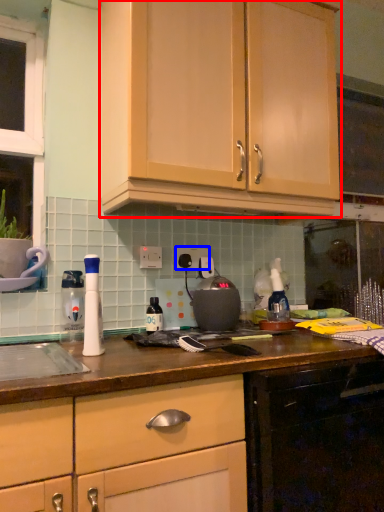
Question: Which point is closer to the camera, cabinetry (highlighted by a red box) or electric outlet (highlighted by a blue box)?

Choices:
 (A) cabinetry
 (B) electric outlet

Answer: (A)